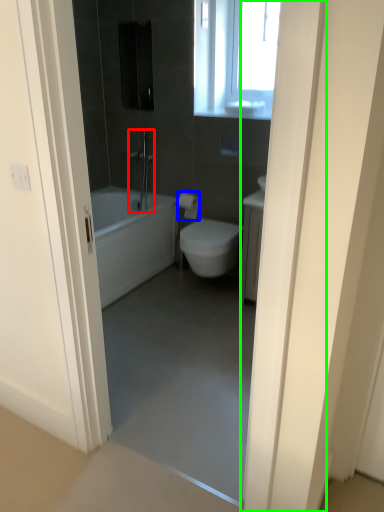
Question: Based on their relative distances, which object is farther from shower (highlighted by a red box)? Choose from toilet paper (highlighted by a blue box) and door (highlighted by a green box).

Choices:
 (A) toilet paper
 (B) door

Answer: (B)